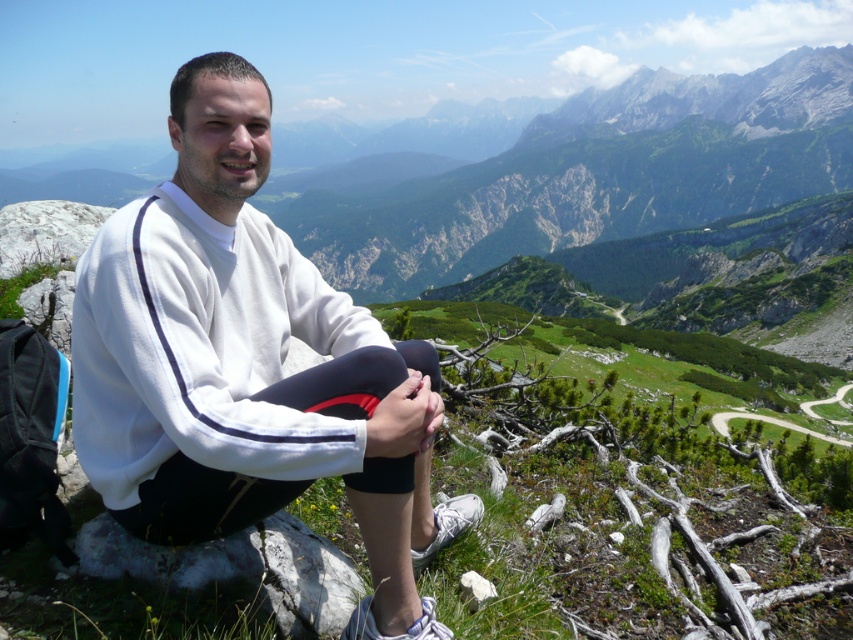
Can you confirm if white fleece at center is positioned above white rough rock at lower center?

Yes, white fleece at center is above white rough rock at lower center.

You are a GUI agent. You are given a task and a screenshot of the screen. Output one action in this format:
    pyautogui.click(x=<x>, y=<y>)
    Task: Click on the white fleece at center
    This screenshot has height=640, width=853.
    Given the screenshot: What is the action you would take?
    pyautogui.click(x=247, y=365)

Who is more distant from viewer, (402, 365) or (251, 564)?

The point (402, 365) is more distant.

At what (x,y) coordinates should I click in order to perform the action: click on white fleece at center. Please return your answer as a coordinate pair (x, y). The height and width of the screenshot is (640, 853). Looking at the image, I should click on (247, 365).